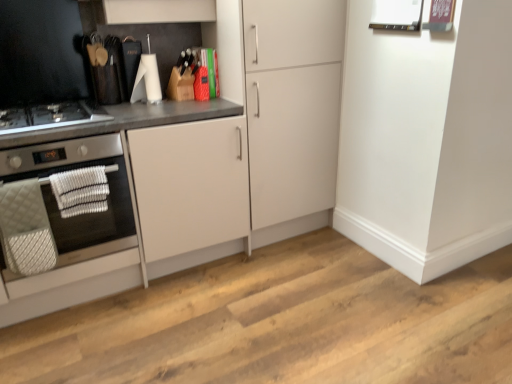
Question: Considering the positions of silver metallic oven at left and white matte cabinet at center, the second cabinetry positioned from the left, in the image, is silver metallic oven at left bigger or smaller than white matte cabinet at center, the second cabinetry positioned from the left,?

Choices:
 (A) big
 (B) small

Answer: (B)

Question: Would you say silver metallic oven at left is to the left or to the right of white matte cabinet at center, the second cabinetry positioned from the left, in the picture?

Choices:
 (A) right
 (B) left

Answer: (B)

Question: Estimate the real-world distances between objects in this image. Which object is closer to the white matte cabinet at left, positioned as the first cabinetry in left-to-right order?

Choices:
 (A) silver metallic oven at left
 (B) black glass gas stove at left
 (C) white matte cabinet at center, the second cabinetry positioned from the left

Answer: (C)

Question: Based on their relative distances, which object is nearer to the silver metallic oven at left?

Choices:
 (A) white matte cabinet at left, positioned as the first cabinetry in left-to-right order
 (B) white matte cabinet at center, the second cabinetry positioned from the left
 (C) black glass gas stove at left

Answer: (C)